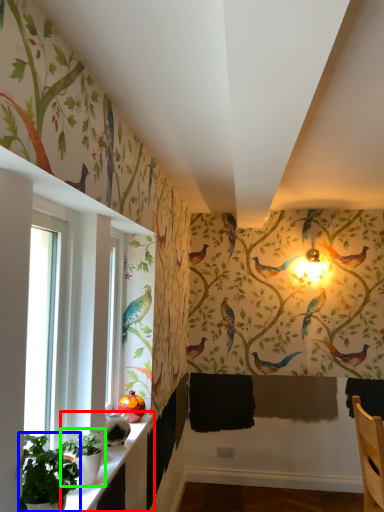
Question: Considering the real-world distances, which object is closest to window sill (highlighted by a red box)? plant (highlighted by a blue box) or plant (highlighted by a green box).

Choices:
 (A) plant
 (B) plant

Answer: (B)